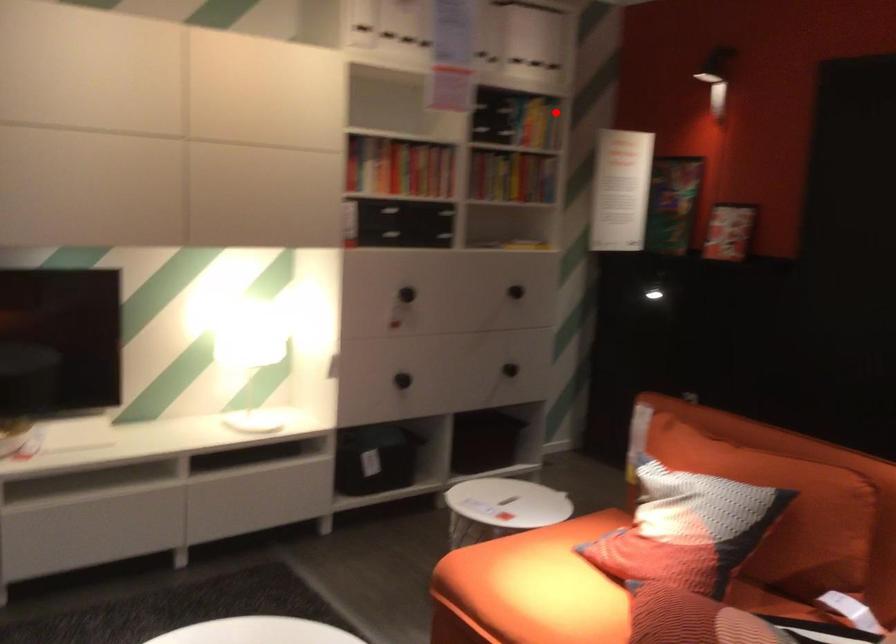
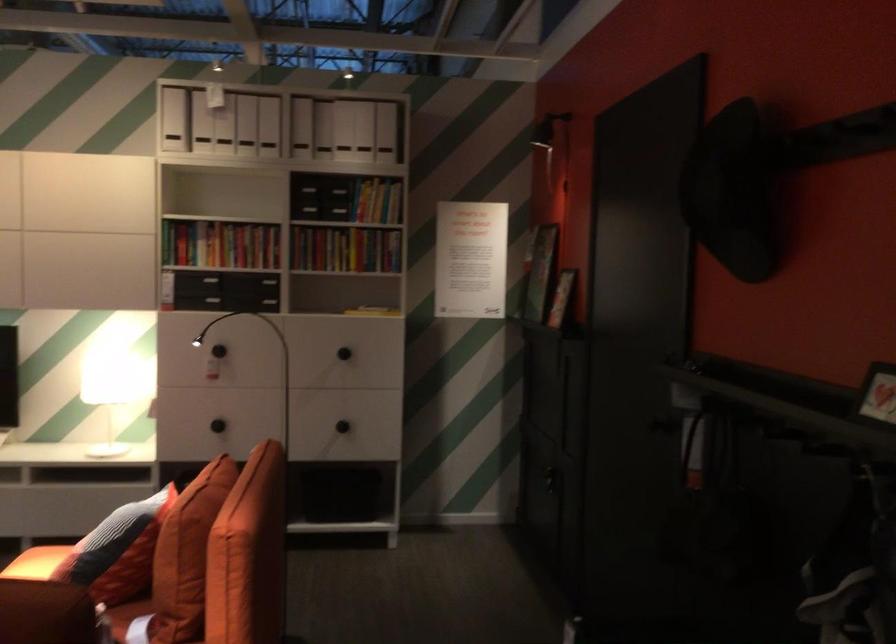
Question: I am providing you with two images of the same scene from different viewpoints. A red point is shown in image1. For the corresponding object point in image2, is it positioned nearer or farther from the camera?

Choices:
 (A) Nearer
 (B) Farther

Answer: (B)